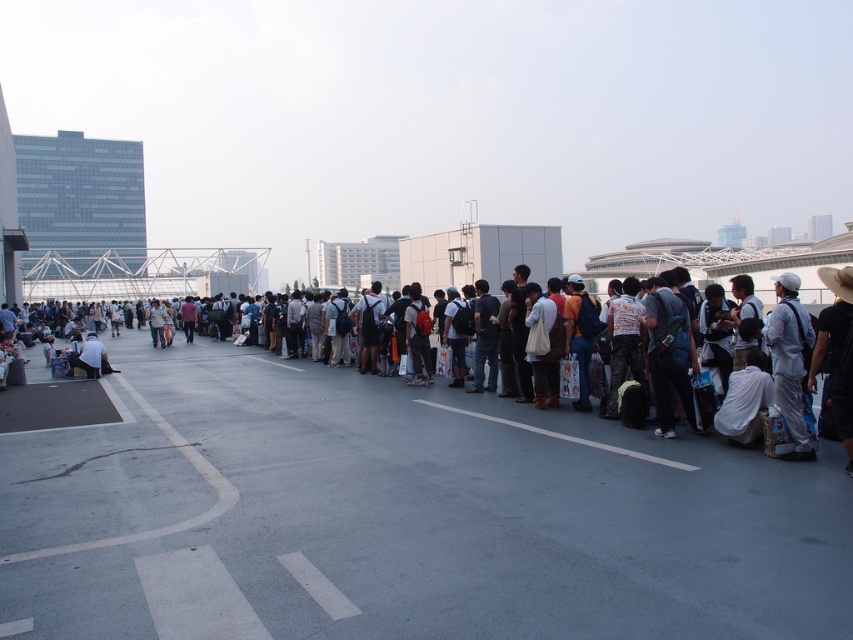
Question: Does dark gray backpack at center have a larger size compared to white fabric bag at right?

Choices:
 (A) no
 (B) yes

Answer: (B)

Question: Which of the following is the farthest from the observer?

Choices:
 (A) (91, 364)
 (B) (113, 401)
 (C) (648, 461)

Answer: (A)

Question: Is dark gray backpack at center thinner than light brown leather jacket at lower left?

Choices:
 (A) yes
 (B) no

Answer: (B)

Question: Can you confirm if dark gray backpack at center is positioned to the left of light brown leather jacket at lower left?

Choices:
 (A) no
 (B) yes

Answer: (A)

Question: Based on their relative distances, which object is farther from the white fabric bag at right?

Choices:
 (A) light brown leather jacket at lower left
 (B) dark gray backpack at center

Answer: (A)

Question: Which of the following is the closest to the observer?

Choices:
 (A) white fabric bag at right
 (B) black fabric bag at center

Answer: (A)